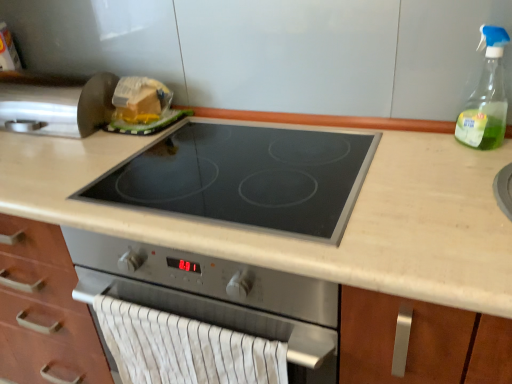
Question: Based on their positions, is black glass cooktop at center located to the left or right of translucent plastic cheese at upper left?

Choices:
 (A) right
 (B) left

Answer: (A)

Question: From the image's perspective, relative to translucent plastic cheese at upper left, is black glass cooktop at center above or below?

Choices:
 (A) above
 (B) below

Answer: (B)

Question: Which of these objects is positioned farthest from the beige laminate countertop at center?

Choices:
 (A) black glass cooktop at center
 (B) metallic silver knife at upper left
 (C) clear glass spray bottle at upper right
 (D) translucent plastic cheese at upper left
 (E) white striped fabric hand towel at lower center

Answer: (D)

Question: Estimate the real-world distances between objects in this image. Which object is closer to the white striped fabric hand towel at lower center?

Choices:
 (A) beige laminate countertop at center
 (B) metallic silver knife at upper left
 (C) translucent plastic cheese at upper left
 (D) clear glass spray bottle at upper right
 (E) black glass cooktop at center

Answer: (A)